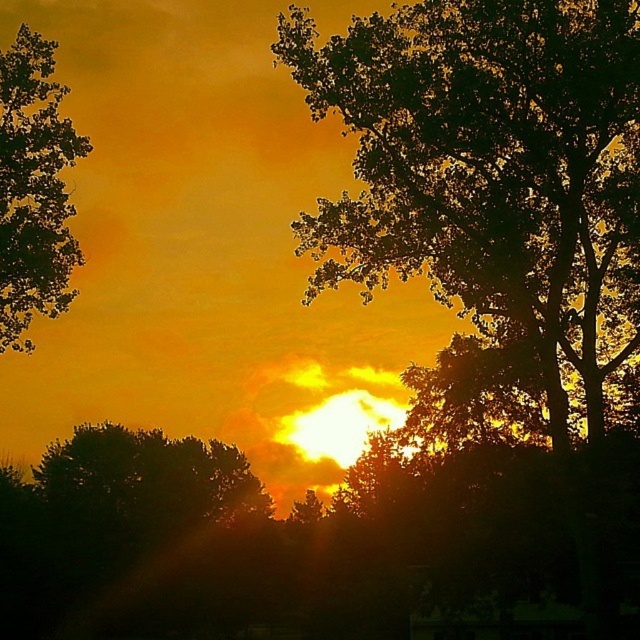
Question: Does dark green leafy tree at center have a larger size compared to dark green leafy tree at left?

Choices:
 (A) no
 (B) yes

Answer: (B)

Question: Does dark green leafy tree at center have a smaller size compared to dark green leafy tree at left?

Choices:
 (A) yes
 (B) no

Answer: (B)

Question: Does dark green leafy tree at center appear under dark green leafy tree at left?

Choices:
 (A) no
 (B) yes

Answer: (B)

Question: Among these points, which one is nearest to the camera?

Choices:
 (A) 388,214
 (B) 36,84

Answer: (B)